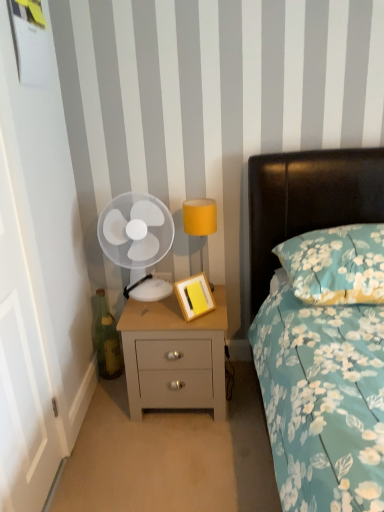
The width and height of the screenshot is (384, 512). What do you see at coordinates (200, 219) in the screenshot?
I see `yellow fabric lampshade at upper right` at bounding box center [200, 219].

In order to click on light gray wood nightstand at center in this screenshot , I will do `click(174, 356)`.

What do you see at coordinates (174, 356) in the screenshot? The height and width of the screenshot is (512, 384). I see `light gray wood nightstand at center` at bounding box center [174, 356].

Image resolution: width=384 pixels, height=512 pixels. Identify the location of floral fabric pillow at upper right. (336, 264).

This screenshot has width=384, height=512. Describe the element at coordinates (194, 296) in the screenshot. I see `wooden picture frame at center` at that location.

At what (x,y) coordinates should I click in order to perform the action: click on green glass bottle at lower left. Please return your answer as a coordinate pair (x, y). Looking at the image, I should click on (107, 341).

Would you consider green glass bottle at lower left to be distant from yellow fabric lampshade at upper right?

That's not correct — green glass bottle at lower left is a little close to yellow fabric lampshade at upper right.

Consider the image. Is green glass bottle at lower left spatially inside yellow fabric lampshade at upper right, or outside of it?

green glass bottle at lower left lies outside yellow fabric lampshade at upper right.

Is green glass bottle at lower left aimed at yellow fabric lampshade at upper right?

No, green glass bottle at lower left does not turn towards yellow fabric lampshade at upper right.

Who is bigger, green glass bottle at lower left or yellow fabric lampshade at upper right?

With larger size is yellow fabric lampshade at upper right.

The width and height of the screenshot is (384, 512). Identify the location of pillow in front of the white plastic fan at left. (336, 264).

How far apart are white plastic fan at left and floral fabric pillow at upper right?

white plastic fan at left and floral fabric pillow at upper right are 68.62 centimeters apart.

Which object is positioned more to the left, white plastic fan at left or floral fabric pillow at upper right?

From the viewer's perspective, white plastic fan at left appears more on the left side.

Is white plastic fan at left not inside floral fabric pillow at upper right?

Yes, white plastic fan at left is outside of floral fabric pillow at upper right.

Can we say wooden picture frame at center lies outside light gray wood nightstand at center?

That's correct, wooden picture frame at center is outside of light gray wood nightstand at center.

How many degrees apart are the facing directions of wooden picture frame at center and light gray wood nightstand at center?

There is a 45.3-degree angle between the facing directions of wooden picture frame at center and light gray wood nightstand at center.

From a real-world perspective, is wooden picture frame at center located higher than light gray wood nightstand at center?

Yes, from a real-world perspective, wooden picture frame at center is over light gray wood nightstand at center

Considering the sizes of wooden picture frame at center and light gray wood nightstand at center in the image, is wooden picture frame at center wider or thinner than light gray wood nightstand at center?

Considering their sizes, wooden picture frame at center looks slimmer than light gray wood nightstand at center.

From the image's perspective, is yellow fabric lampshade at upper right above or below wooden picture frame at center?

From the image's perspective, yellow fabric lampshade at upper right appears above wooden picture frame at center.

Does yellow fabric lampshade at upper right appear on the left side of wooden picture frame at center?

In fact, yellow fabric lampshade at upper right is to the right of wooden picture frame at center.

Considering the relative sizes of yellow fabric lampshade at upper right and wooden picture frame at center in the image provided, is yellow fabric lampshade at upper right taller than wooden picture frame at center?

Indeed, yellow fabric lampshade at upper right has a greater height compared to wooden picture frame at center.

Is point (122, 209) in front of point (188, 214)?

No, (122, 209) is behind (188, 214).

Can you confirm if white plastic fan at left is smaller than yellow fabric lampshade at upper right?

Actually, white plastic fan at left might be larger than yellow fabric lampshade at upper right.

Is white plastic fan at left looking in the opposite direction of yellow fabric lampshade at upper right?

No, white plastic fan at left's orientation is not away from yellow fabric lampshade at upper right.

Which of these two, green glass bottle at lower left or white plastic fan at left, is bigger?

Bigger between the two is white plastic fan at left.

Is point (108, 325) less distant than point (136, 265)?

No, it is not.

Considering the sizes of green glass bottle at lower left and white plastic fan at left in the image, is green glass bottle at lower left taller or shorter than white plastic fan at left?

In the image, green glass bottle at lower left appears to be shorter than white plastic fan at left.

Is white plastic fan at left a part of green glass bottle at lower left?

No, white plastic fan at left is not a part of green glass bottle at lower left.

Can you tell me how much green glass bottle at lower left and floral fabric pillow at upper right differ in facing direction?

2.56 degrees separate the facing orientations of green glass bottle at lower left and floral fabric pillow at upper right.

Can you confirm if green glass bottle at lower left is taller than floral fabric pillow at upper right?

Yes.

Between green glass bottle at lower left and floral fabric pillow at upper right, which one appears on the right side from the viewer's perspective?

Positioned to the right is floral fabric pillow at upper right.

Is green glass bottle at lower left not near floral fabric pillow at upper right?

Absolutely, green glass bottle at lower left is distant from floral fabric pillow at upper right.

The image size is (384, 512). I want to click on bottle on the left of yellow fabric lampshade at upper right, so click(107, 341).

What are the coordinates of `pillow in front of the white plastic fan at left` in the screenshot? It's located at (336, 264).

Which object lies nearer to the anchor point light gray wood nightstand at center, floral fabric pillow at upper right or white plastic fan at left?

white plastic fan at left is positioned closer to the anchor light gray wood nightstand at center.

Considering their positions, is wooden picture frame at center positioned closer to floral fabric pillow at upper right than green glass bottle at lower left?

Among the two, wooden picture frame at center is located nearer to floral fabric pillow at upper right.

When comparing their distances from white plastic fan at left, does yellow fabric lampshade at upper right or green glass bottle at lower left seem further?

The object further to white plastic fan at left is green glass bottle at lower left.

Considering their positions, is yellow fabric lampshade at upper right positioned further to green glass bottle at lower left than wooden picture frame at center?

yellow fabric lampshade at upper right.

Consider the image. Estimate the real-world distances between objects in this image. Which object is further from green glass bottle at lower left, light gray wood nightstand at center or yellow fabric lampshade at upper right?

yellow fabric lampshade at upper right is further to green glass bottle at lower left.

Estimate the real-world distances between objects in this image. Which object is closer to yellow fabric lampshade at upper right, white plastic fan at left or floral fabric pillow at upper right?

white plastic fan at left lies closer to yellow fabric lampshade at upper right than the other object.

In the scene shown: When comparing their distances from wooden picture frame at center, does yellow fabric lampshade at upper right or light gray wood nightstand at center seem closer?

Among the two, light gray wood nightstand at center is located nearer to wooden picture frame at center.

From the image, which object appears to be farther from green glass bottle at lower left, wooden picture frame at center or light gray wood nightstand at center?

wooden picture frame at center lies further to green glass bottle at lower left than the other object.

The width and height of the screenshot is (384, 512). I want to click on bedside lamp between white plastic fan at left and green glass bottle at lower left in the vertical direction, so click(200, 219).

Locate an element on the screen. mechanical fan between green glass bottle at lower left and floral fabric pillow at upper right from left to right is located at coordinates (135, 232).

At what (x,y) coordinates should I click in order to perform the action: click on nightstand between green glass bottle at lower left and wooden picture frame at center. Please return your answer as a coordinate pair (x, y). The width and height of the screenshot is (384, 512). Looking at the image, I should click on (174, 356).

Locate an element on the screen. The image size is (384, 512). picture frame between yellow fabric lampshade at upper right and light gray wood nightstand at center vertically is located at coordinates (194, 296).